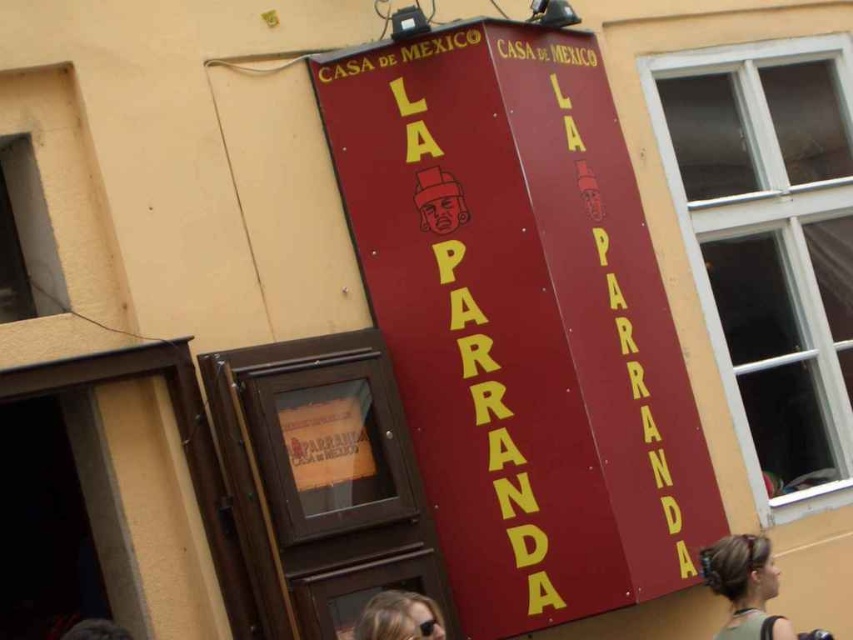
Question: Can you confirm if matte red sign at center is positioned to the right of blonde hair at lower center?

Choices:
 (A) no
 (B) yes

Answer: (B)

Question: Which object is closer to the camera taking this photo?

Choices:
 (A) blonde hair at center
 (B) matte red sign at center
 (C) blonde hair at lower center

Answer: (C)

Question: Which object is positioned farthest from the blonde hair at center?

Choices:
 (A) blonde hair at lower center
 (B) matte red sign at center

Answer: (B)

Question: Which object is the closest to the blonde hair at lower center?

Choices:
 (A) blonde hair at center
 (B) matte red sign at center

Answer: (A)

Question: Does blonde hair at center appear over blonde hair at lower center?

Choices:
 (A) no
 (B) yes

Answer: (A)

Question: Can you confirm if matte red sign at center is positioned below blonde hair at lower center?

Choices:
 (A) yes
 (B) no

Answer: (B)